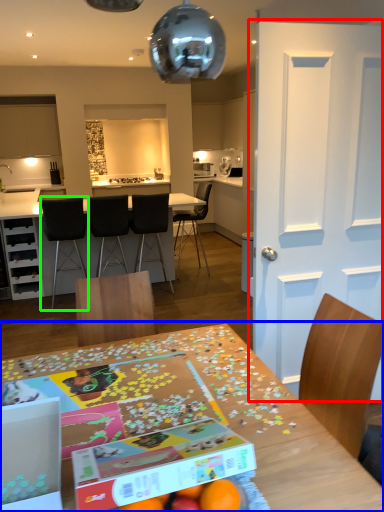
Question: Considering the real-world distances, which object is farthest from door (highlighted by a red box)? table (highlighted by a blue box) or chair (highlighted by a green box)?

Choices:
 (A) table
 (B) chair

Answer: (B)